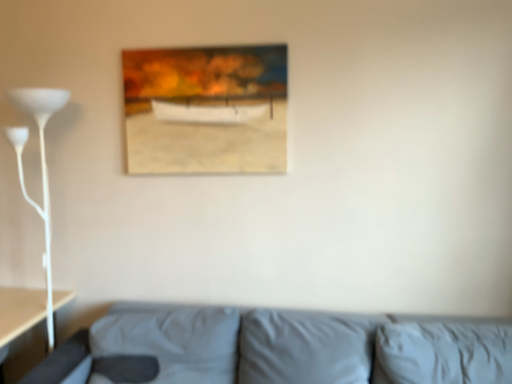
Question: Is wooden frame at upper center bigger than white glossy floor lamp at left?

Choices:
 (A) no
 (B) yes

Answer: (A)

Question: Is wooden frame at upper center to the left of white glossy floor lamp at left from the viewer's perspective?

Choices:
 (A) yes
 (B) no

Answer: (B)

Question: Can you confirm if wooden frame at upper center is thinner than white glossy floor lamp at left?

Choices:
 (A) no
 (B) yes

Answer: (B)

Question: Is wooden frame at upper center oriented away from white glossy floor lamp at left?

Choices:
 (A) yes
 (B) no

Answer: (B)

Question: Would you say wooden frame at upper center contains white glossy floor lamp at left?

Choices:
 (A) yes
 (B) no

Answer: (B)

Question: From the image's perspective, is white glossy floor lamp at left located above or below wooden frame at upper center?

Choices:
 (A) below
 (B) above

Answer: (A)

Question: Considering the positions of point pos(66,92) and point pos(271,144), is point pos(66,92) closer or farther from the camera than point pos(271,144)?

Choices:
 (A) closer
 (B) farther

Answer: (B)

Question: Is white glossy floor lamp at left in front of or behind wooden frame at upper center in the image?

Choices:
 (A) behind
 (B) front

Answer: (B)

Question: In terms of width, does white glossy floor lamp at left look wider or thinner when compared to wooden frame at upper center?

Choices:
 (A) wide
 (B) thin

Answer: (A)

Question: From a real-world perspective, is white glossy floor lamp at left above or below gray fabric couch at lower center?

Choices:
 (A) above
 (B) below

Answer: (A)

Question: In terms of height, does white glossy floor lamp at left look taller or shorter compared to gray fabric couch at lower center?

Choices:
 (A) tall
 (B) short

Answer: (A)

Question: Looking at the image, does white glossy floor lamp at left seem bigger or smaller compared to gray fabric couch at lower center?

Choices:
 (A) small
 (B) big

Answer: (A)

Question: Is white glossy floor lamp at left wider or thinner than gray fabric couch at lower center?

Choices:
 (A) thin
 (B) wide

Answer: (A)

Question: Is wooden frame at upper center in front of or behind white glossy floor lamp at left in the image?

Choices:
 (A) behind
 (B) front

Answer: (A)

Question: From their relative heights in the image, would you say wooden frame at upper center is taller or shorter than white glossy floor lamp at left?

Choices:
 (A) short
 (B) tall

Answer: (A)